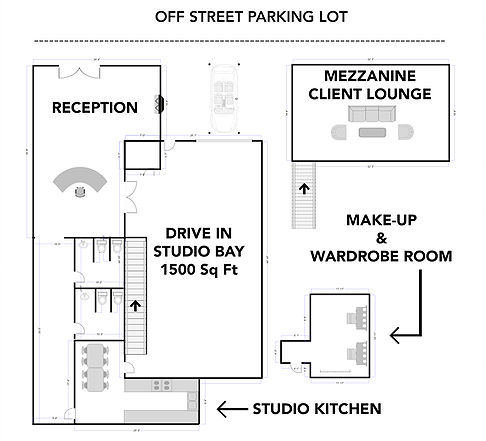
Where is `lounge seating`? Image resolution: width=486 pixels, height=441 pixels. lounge seating is located at coordinates (338, 130), (355, 114), (369, 116), (384, 116), (401, 133).